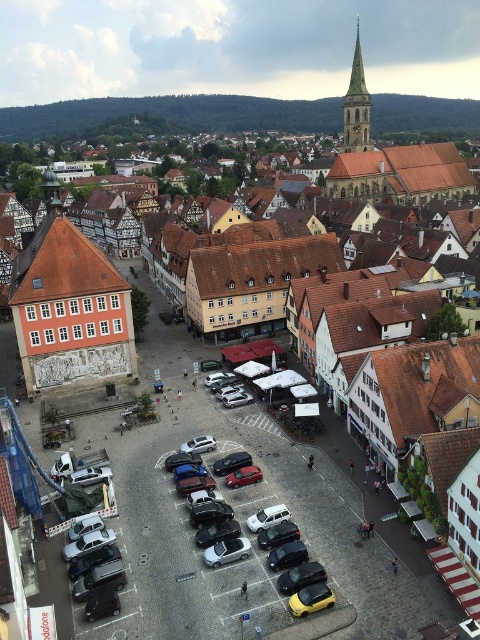
Can you confirm if yellow matte car at lower center is shorter than shiny black sedan at center?

Incorrect, yellow matte car at lower center's height does not fall short of shiny black sedan at center's.

Looking at this image, is yellow matte car at lower center bigger than shiny black sedan at center?

Correct, yellow matte car at lower center is larger in size than shiny black sedan at center.

Which is in front, point (278, 589) or point (276, 538)?

Point (278, 589) is more forward.

Locate an element on the screen. This screenshot has height=640, width=480. yellow matte car at lower center is located at coordinates 300,577.

Does smooth stone spire at upper center have a larger size compared to white matte van at center?

Indeed, smooth stone spire at upper center has a larger size compared to white matte van at center.

Which is above, smooth stone spire at upper center or white matte van at center?

smooth stone spire at upper center

Locate an element on the screen. The height and width of the screenshot is (640, 480). smooth stone spire at upper center is located at coordinates (357, 106).

Based on the photo, does yellow matte car at lower center have a larger size compared to metallic silver car at center?

Incorrect, yellow matte car at lower center is not larger than metallic silver car at center.

Is yellow matte car at lower center further to the viewer compared to metallic silver car at center?

No, it is not.

Between point (304, 580) and point (220, 472), which one is positioned in front?

Point (304, 580) is in front.

What are the coordinates of `yellow matte car at lower center` in the screenshot? It's located at click(300, 577).